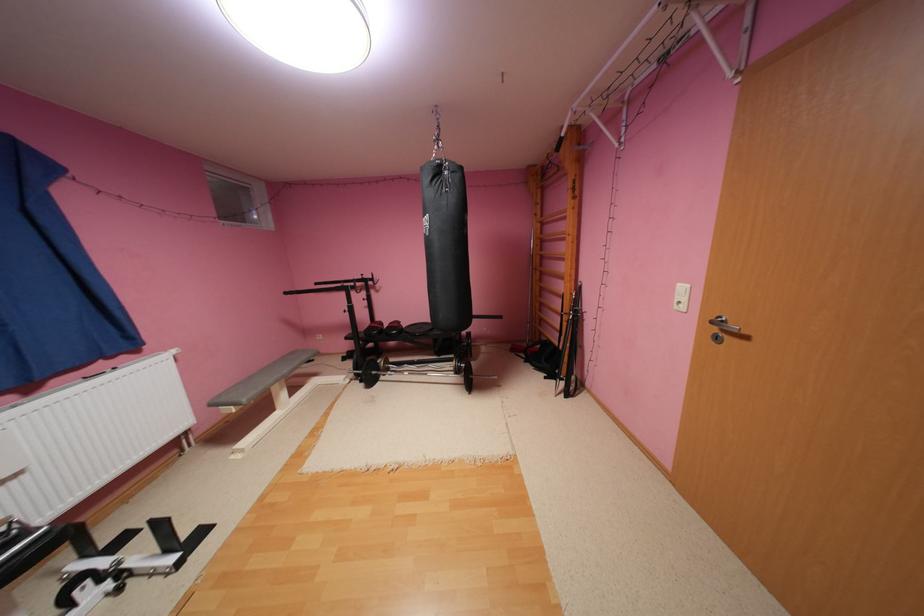
Find the location of `wooden ladder rung`. wooden ladder rung is located at coordinates (554, 237).